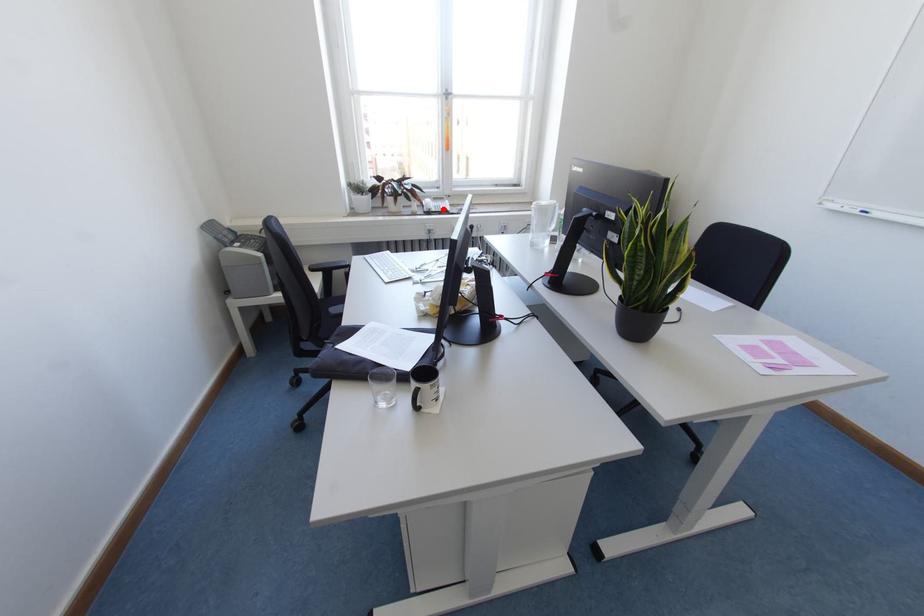
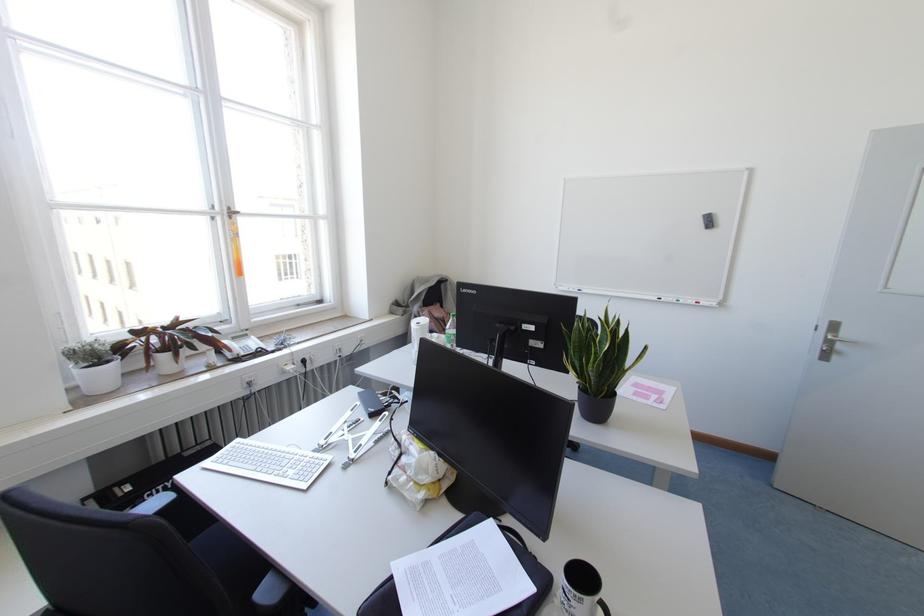
In the second image, find the point that corresponds to the highlighted location in the first image.

(258, 349)